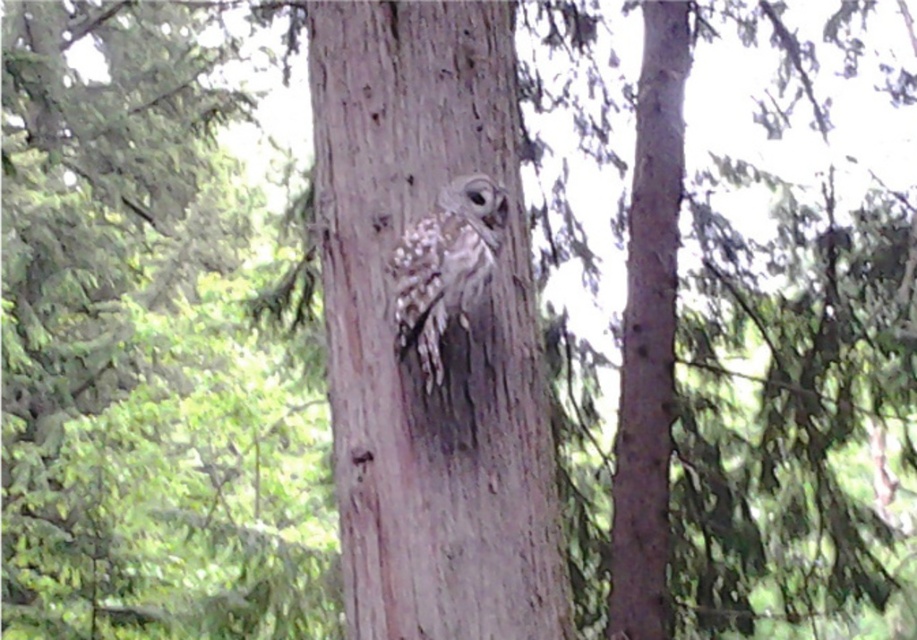
You are an ornithologist observing the smooth bark tree trunk at center and the speckled feathered owl at center. Which object is positioned higher in the image?

The speckled feathered owl at center is positioned higher than the smooth bark tree trunk at center.

You are standing in a forest and see two points marked on a tree trunk. The first point is at coordinates point (639, 80) and the second is at point (456, 291). Which point is closer to you?

Point (639, 80) is further to the viewer than point (456, 291), so the second point is closer to you.